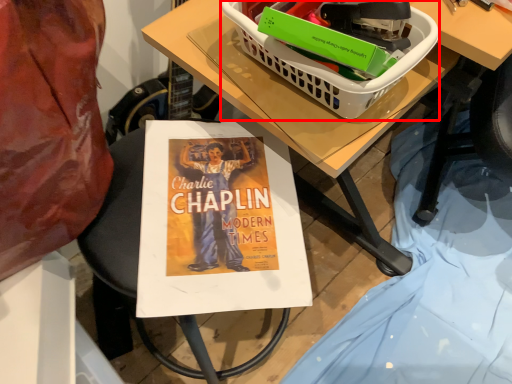
Question: Where is basket (annotated by the red box) located in relation to table in the image?

Choices:
 (A) left
 (B) right

Answer: (A)